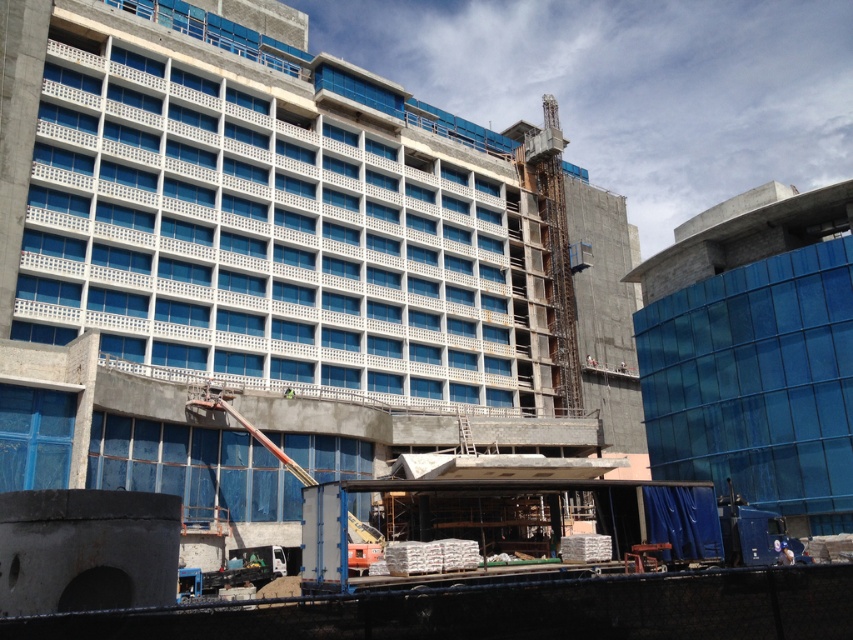
Question: Which of the following is the farthest from the observer?

Choices:
 (A) transparent glass building at right
 (B) concrete building at center

Answer: (A)

Question: Which point is farther from the camera taking this photo?

Choices:
 (A) (x=405, y=138)
 (B) (x=705, y=284)

Answer: (A)

Question: Does concrete building at center appear under transparent glass building at right?

Choices:
 (A) yes
 (B) no

Answer: (B)

Question: Does concrete building at center come behind transparent glass building at right?

Choices:
 (A) no
 (B) yes

Answer: (A)

Question: Does concrete building at center have a larger size compared to transparent glass building at right?

Choices:
 (A) yes
 (B) no

Answer: (A)

Question: Among these points, which one is farthest from the camera?

Choices:
 (A) (821, 253)
 (B) (283, 506)

Answer: (A)